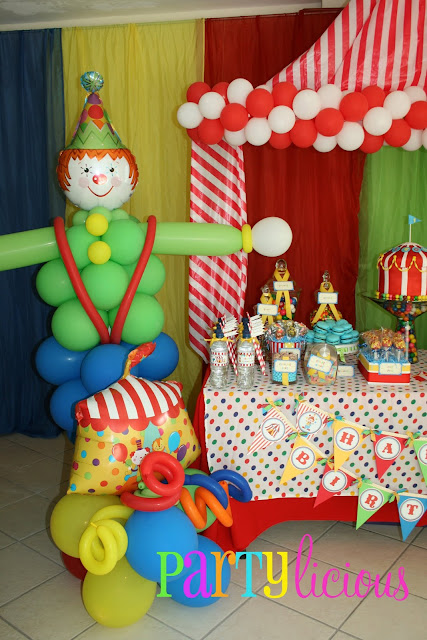
Find the location of a particular element. The image size is (427, 640). table is located at coordinates (370, 393).